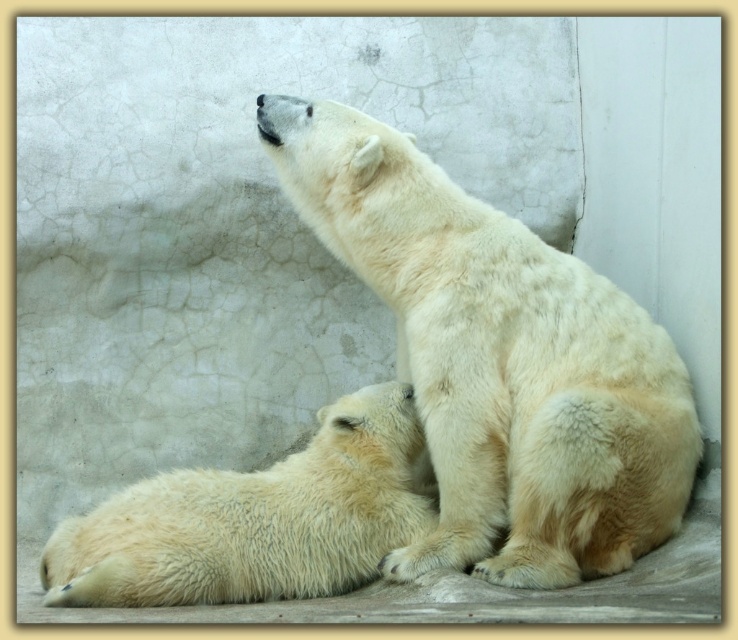
You are a zookeeper observing two polar bears in their enclosure. You notice a white fluffy polar bear at center and a white fluffy polar bear at lower left. Which polar bear is positioned to the right of the other?

The white fluffy polar bear at center is to the right of the white fluffy polar bear at lower left.

You are standing at the point labeled point [523,572] in the polar bear enclosure. You want to take a photo of the bears using a camera that has a focal length of 50mm. If the distance between you and the camera is 2.86 meters, what is the approximate angle of view needed to capture both polar bears in the frame?

The point labeled point [523,572] is 2.86 meters away from the camera. To capture both polar bears in the frame, you would need an angle of view that accommodates their positions within the enclosure. However, without specific information about the bears

You are standing in front of the polar bear enclosure and want to determine which of the two points, point (265, 145) or point (382, 468), is closer to you. Based on the image, which point is nearer?

Point (265, 145) is further to the viewer than point (382, 468). Wait, no, the description says the first point is further to the viewer, meaning it is closer to you. So the answer is point (265, 145) is closer.